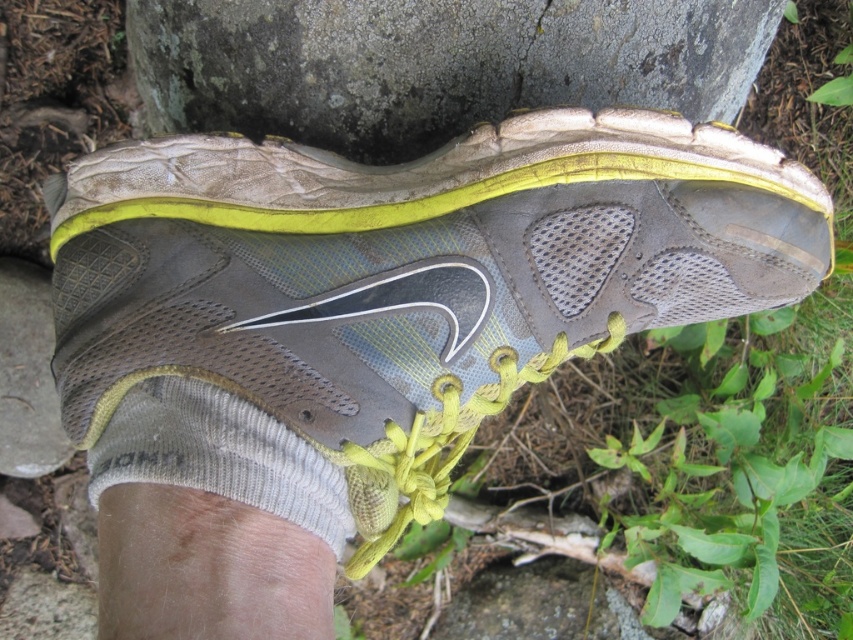
You are examining the shoe from the front. There are two points on the shoe labeled as point (190, 467) and point (670, 99). Which point is nearer to your eyes?

Point (190, 467) is closer to the viewer than point (670, 99).

You are a hiker who needs to decide whether to place the matte gray running shoe at center or the gray rough stone at center into a small backpack compartment. Based on their sizes, which item can fit better into the compartment?

The matte gray running shoe at center has a smaller size compared to the gray rough stone at center, so the matte gray running shoe at center can fit better into the small backpack compartment.

You are a hiker who just found a matte gray running shoe at center and a gray rough stone at center on the trail. Which object is closer to you?

The matte gray running shoe at center is closer to you because it is positioned under the gray rough stone at center, meaning the stone is above it and farther away.